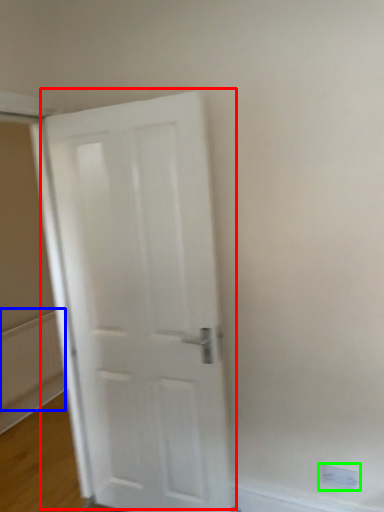
Question: Estimate the real-world distances between objects in this image. Which object is farther from door (highlighted by a red box), radiator (highlighted by a blue box) or electric outlet (highlighted by a green box)?

Choices:
 (A) radiator
 (B) electric outlet

Answer: (A)